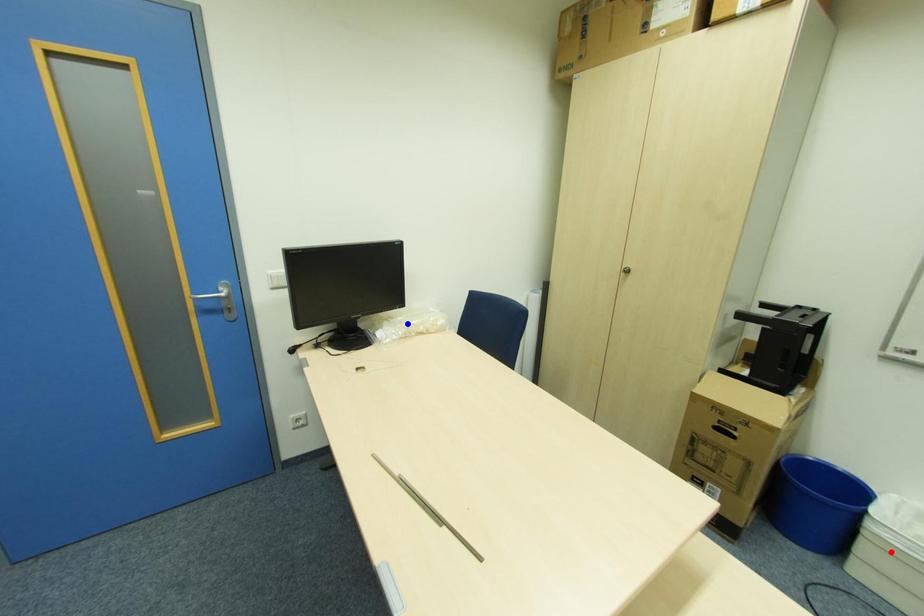
Question: Two points are marked on the image. Which point is closer to the camera?

Choices:
 (A) Blue point is closer.
 (B) Red point is closer.

Answer: (B)